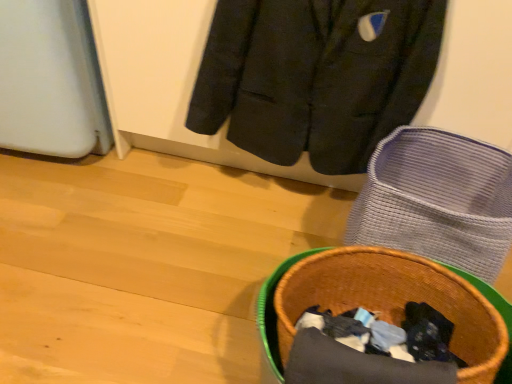
Question: From a real-world perspective, is brown woven basket at lower right positioned over dark gray wool jacket at upper center based on gravity?

Choices:
 (A) no
 (B) yes

Answer: (A)

Question: Can you confirm if brown woven basket at lower right is positioned to the left of dark gray wool jacket at upper center?

Choices:
 (A) yes
 (B) no

Answer: (B)

Question: Is brown woven basket at lower right smaller than dark gray wool jacket at upper center?

Choices:
 (A) no
 (B) yes

Answer: (A)

Question: Is brown woven basket at lower right oriented away from dark gray wool jacket at upper center?

Choices:
 (A) yes
 (B) no

Answer: (A)

Question: From a real-world perspective, is brown woven basket at lower right located beneath dark gray wool jacket at upper center?

Choices:
 (A) no
 (B) yes

Answer: (B)

Question: Is point [x=257, y=309] closer or farther from the camera than point [x=410, y=46]?

Choices:
 (A) closer
 (B) farther

Answer: (B)

Question: Is brown woven basket at lower right bigger or smaller than dark gray wool jacket at upper center?

Choices:
 (A) small
 (B) big

Answer: (B)

Question: Which is correct: brown woven basket at lower right is inside dark gray wool jacket at upper center, or outside of it?

Choices:
 (A) inside
 (B) outside

Answer: (B)

Question: Considering the positions of brown woven basket at lower right and dark gray wool jacket at upper center in the image, is brown woven basket at lower right taller or shorter than dark gray wool jacket at upper center?

Choices:
 (A) short
 (B) tall

Answer: (A)

Question: Considering the positions of woven fabric basket at lower right and brown woven basket at lower right in the image, is woven fabric basket at lower right taller or shorter than brown woven basket at lower right?

Choices:
 (A) short
 (B) tall

Answer: (B)

Question: Choose the correct answer: Is woven fabric basket at lower right inside brown woven basket at lower right or outside it?

Choices:
 (A) outside
 (B) inside

Answer: (A)

Question: From the image's perspective, is woven fabric basket at lower right located above or below brown woven basket at lower right?

Choices:
 (A) above
 (B) below

Answer: (A)

Question: Is woven fabric basket at lower right wider or thinner than brown woven basket at lower right?

Choices:
 (A) wide
 (B) thin

Answer: (B)

Question: From a real-world perspective, is brown woven basket at lower right above or below woven fabric basket at lower right?

Choices:
 (A) below
 (B) above

Answer: (B)

Question: From the image's perspective, is brown woven basket at lower right above or below woven fabric basket at lower right?

Choices:
 (A) above
 (B) below

Answer: (B)